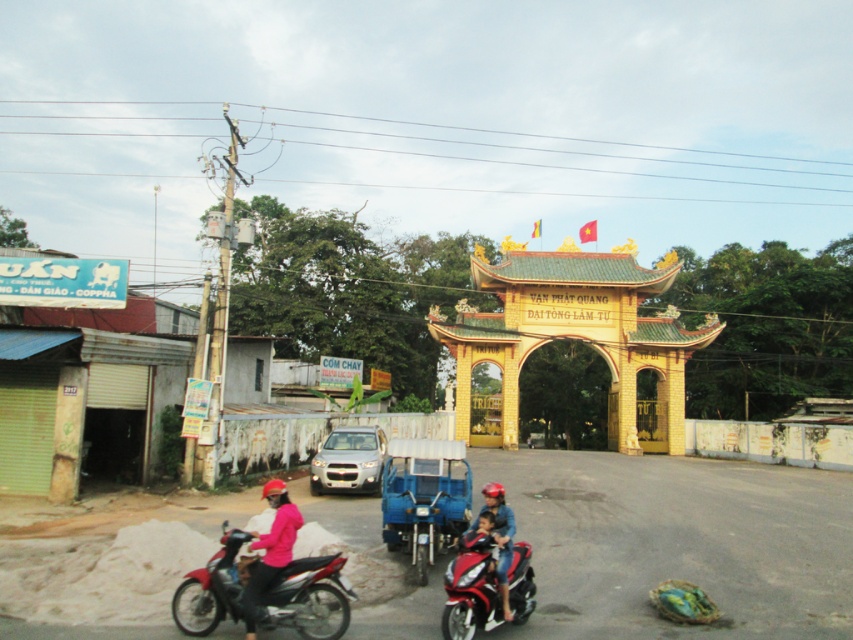
Does shiny red motorcycle at lower center have a lesser height compared to matte pink helmet at center?

Yes, shiny red motorcycle at lower center is shorter than matte pink helmet at center.

Is shiny red motorcycle at lower center positioned at the back of matte pink helmet at center?

That is False.

Is point (524, 573) less distant than point (502, 564)?

No, (524, 573) is behind (502, 564).

Find the location of a particular element. The width and height of the screenshot is (853, 640). shiny red motorcycle at lower center is located at coordinates (469, 588).

Which of these two, shiny red motorcycle at lower left or matte pink helmet at center, stands taller?

Standing taller between the two is matte pink helmet at center.

Which is behind, point (223, 561) or point (498, 586)?

The point (223, 561) is more distant.

Image resolution: width=853 pixels, height=640 pixels. I want to click on shiny red motorcycle at lower left, so click(x=263, y=593).

Is shiny red motorcycle at lower left to the right of pink matte jacket at lower center from the viewer's perspective?

Correct, you'll find shiny red motorcycle at lower left to the right of pink matte jacket at lower center.

Find the location of a particular element. The image size is (853, 640). shiny red motorcycle at lower left is located at coordinates (263, 593).